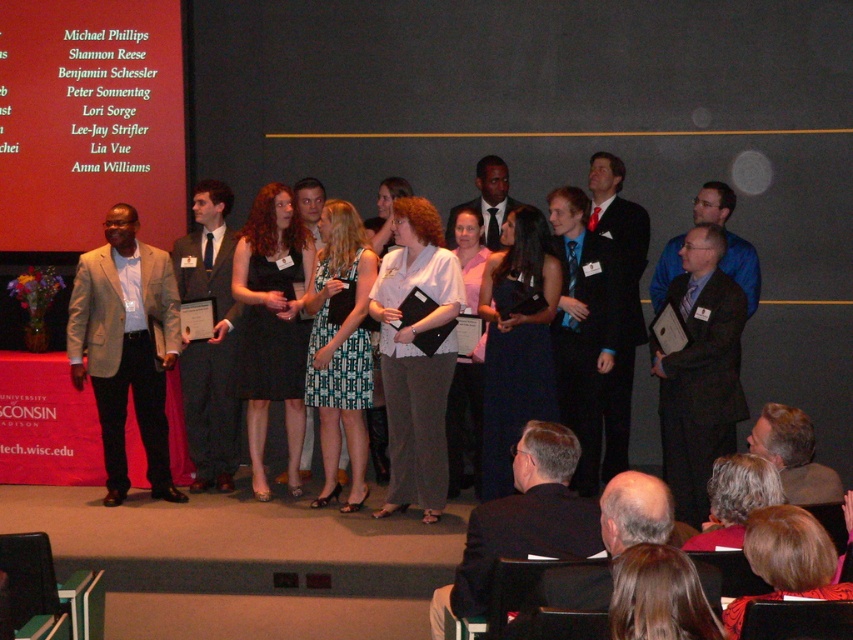
Question: Is light brown suit at left to the left of matte white blouse at center from the viewer's perspective?

Choices:
 (A) yes
 (B) no

Answer: (A)

Question: Can you confirm if light brown suit at left is wider than printed fabric dress at center?

Choices:
 (A) yes
 (B) no

Answer: (A)

Question: From the image, what is the correct spatial relationship of dark gray suit at right in relation to gray hair at lower right?

Choices:
 (A) right
 (B) left

Answer: (B)

Question: Based on their relative distances, which object is farther from the matte black suit at center?

Choices:
 (A) light brown suit at left
 (B) gray suit at center
 (C) shiny black suit at center

Answer: (A)

Question: Which point is farther to the camera?

Choices:
 (A) black dress at center
 (B) shiny black suit at center

Answer: (B)

Question: Estimate the real-world distances between objects in this image. Which object is farther from the white textured blouse at center?

Choices:
 (A) gray suit at center
 (B) matte black suit at center
 (C) gray hair at lower right
 (D) smooth brown hair at lower right

Answer: (D)